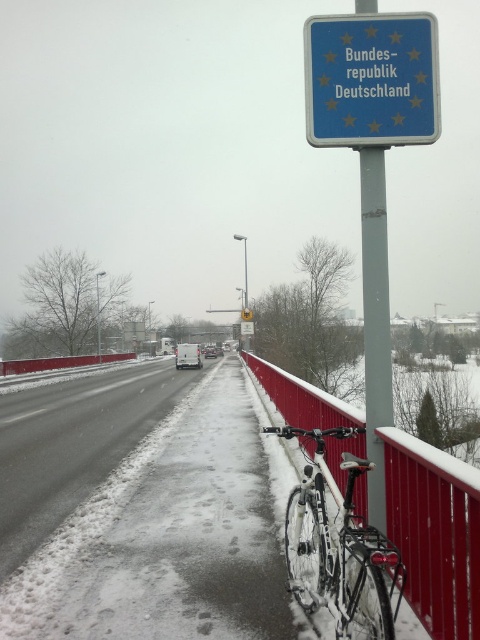
Question: Among these objects, which one is nearest to the camera?

Choices:
 (A) metallic pole at upper center
 (B) blue plastic sign at upper center

Answer: (A)

Question: Which point is closer to the camera?

Choices:
 (A) tap(392, 512)
 (B) tap(317, 96)
 (C) tap(361, 157)
 (D) tap(356, 536)

Answer: (D)

Question: Does snowy asphalt highway at center have a greater width compared to blue plastic sign at upper center?

Choices:
 (A) no
 (B) yes

Answer: (B)

Question: Which point appears closest to the camera in this image?

Choices:
 (A) (324, 470)
 (B) (376, 371)
 (C) (167, 394)
 (D) (417, 545)

Answer: (D)

Question: From the image, what is the correct spatial relationship of snowy asphalt highway at center in relation to white matte van at center?

Choices:
 (A) left
 (B) right

Answer: (A)

Question: Where is shiny metallic bicycle at center located in relation to white matte van at center in the image?

Choices:
 (A) above
 (B) below

Answer: (A)